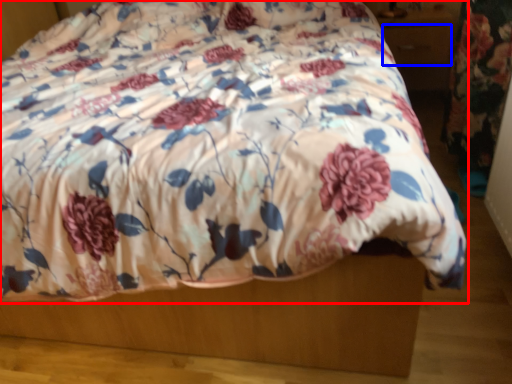
Question: Which point is further to the camera, bed (highlighted by a red box) or drawer (highlighted by a blue box)?

Choices:
 (A) bed
 (B) drawer

Answer: (B)